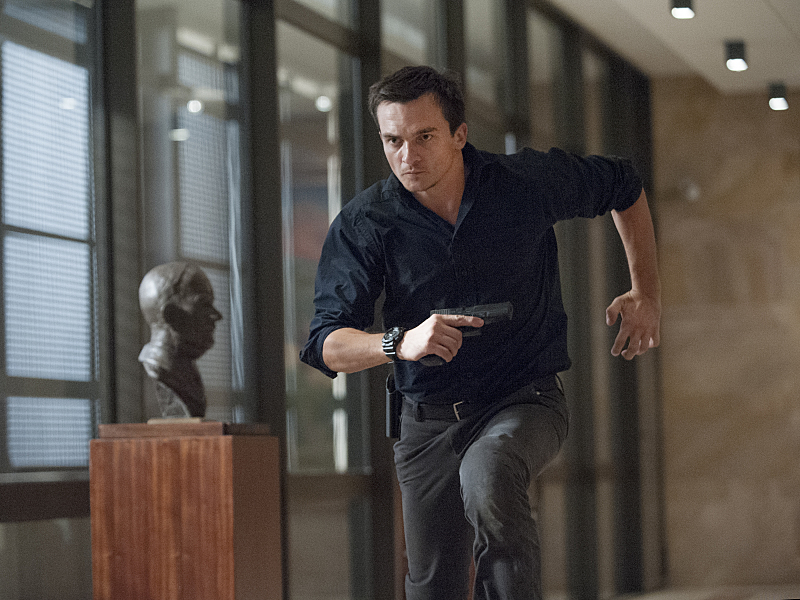
Identify the location of sculpture. Image resolution: width=800 pixels, height=600 pixels. (184, 370).